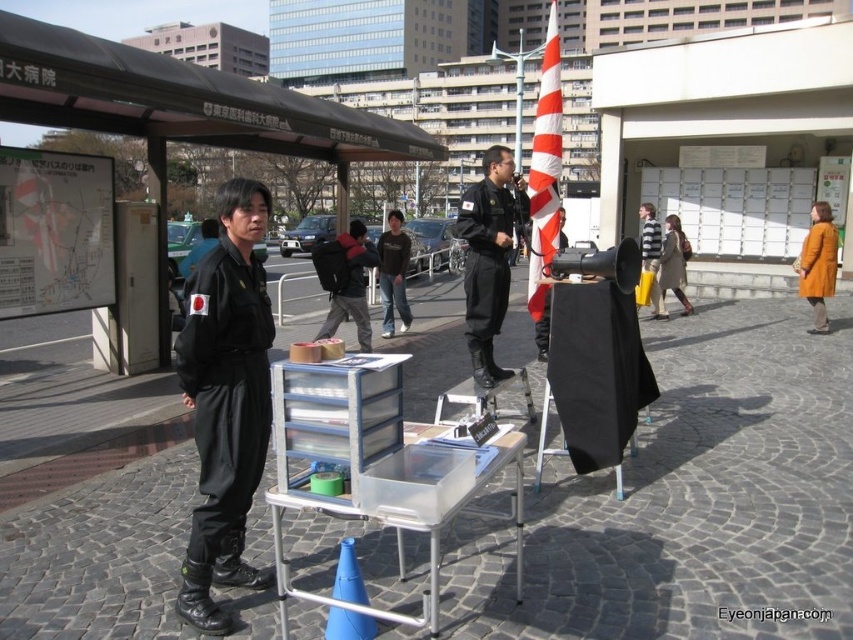
Question: Is black uniform at center behind orange/white striped flag at center?

Choices:
 (A) no
 (B) yes

Answer: (A)

Question: Which of the following is the farthest from the observer?

Choices:
 (A) cobblestone pavement at center
 (B) blue plastic traffic cone at lower center
 (C) dark gray fabric backpack at center

Answer: (C)

Question: Does black uniform at center come in front of brown leather coat at center?

Choices:
 (A) no
 (B) yes

Answer: (B)

Question: Can you confirm if dark gray fabric backpack at center is thinner than dark blue denim jeans at center?

Choices:
 (A) no
 (B) yes

Answer: (A)

Question: Which of the following is the farthest from the observer?

Choices:
 (A) (645, 262)
 (B) (416, 561)
 (C) (405, 262)
 (D) (502, 248)

Answer: (A)

Question: Estimate the real-world distances between objects in this image. Which object is farther from the orange/white striped flag at center?

Choices:
 (A) cobblestone pavement at center
 (B) black uniform at center
 (C) black matte uniform at center

Answer: (B)